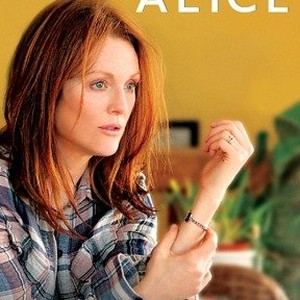
Where is `black frame`? The image size is (300, 300). black frame is located at coordinates (192, 128).